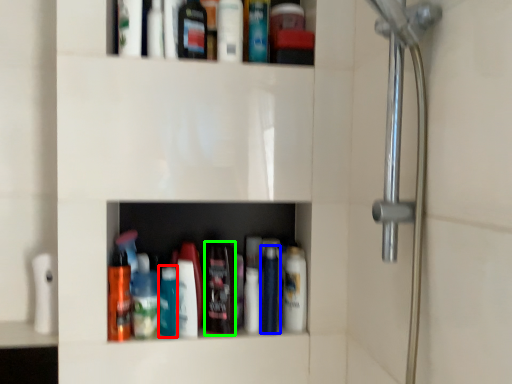
Question: Based on their relative distances, which object is farther from bottle (highlighted by a red box)? Choose from mouthwash (highlighted by a blue box) and mouthwash (highlighted by a green box).

Choices:
 (A) mouthwash
 (B) mouthwash

Answer: (A)